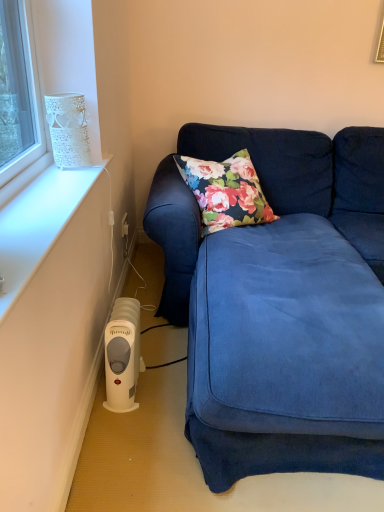
At what (x,y) coordinates should I click in order to perform the action: click on velvet blue couch at lower right. Please return your answer as a coordinate pair (x, y). Image resolution: width=384 pixels, height=512 pixels. Looking at the image, I should click on (263, 284).

In order to face white textured vase at upper left, should I rotate leftwards or rightwards?

To align with it, rotate left about 15.837°.

Image resolution: width=384 pixels, height=512 pixels. I want to click on white plastic heater at lower left, so click(x=122, y=355).

Is white plastic heater at lower left in front of velvet blue couch at lower right?

No, it is not.

In terms of size, does white plastic heater at lower left appear bigger or smaller than velvet blue couch at lower right?

In the image, white plastic heater at lower left appears to be smaller than velvet blue couch at lower right.

How much distance is there between white plastic heater at lower left and velvet blue couch at lower right?

57.08 centimeters.

Could you tell me if white plastic heater at lower left is facing velvet blue couch at lower right?

Yes.

Is white textured vase at upper left outside of velvet blue couch at lower right?

Yes, white textured vase at upper left is outside of velvet blue couch at lower right.

From the image's perspective, is white textured vase at upper left beneath velvet blue couch at lower right?

No, from the image's perspective, white textured vase at upper left is not beneath velvet blue couch at lower right.

Measure the distance between white textured vase at upper left and velvet blue couch at lower right.

white textured vase at upper left and velvet blue couch at lower right are 80.20 centimeters apart from each other.

From a real-world perspective, is white textured vase at upper left located beneath velvet blue couch at lower right?

Incorrect, from a real-world perspective, white textured vase at upper left is higher than velvet blue couch at lower right.

Considering the positions of points (181, 283) and (136, 307), is point (181, 283) farther from camera compared to point (136, 307)?

No.

What's the angular difference between velvet blue couch at lower right and white plastic heater at lower left's facing directions?

There is a 3.24-degree angle between the facing directions of velvet blue couch at lower right and white plastic heater at lower left.

Is velvet blue couch at lower right oriented away from white plastic heater at lower left?

velvet blue couch at lower right does not have its back to white plastic heater at lower left.

Who is smaller, velvet blue couch at lower right or white plastic heater at lower left?

Smaller between the two is white plastic heater at lower left.

Considering the sizes of objects velvet blue couch at lower right and white textured vase at upper left in the image provided, who is smaller, velvet blue couch at lower right or white textured vase at upper left?

Smaller between the two is white textured vase at upper left.

Which object is wider, velvet blue couch at lower right or white textured vase at upper left?

Wider between the two is velvet blue couch at lower right.

What's the angular difference between velvet blue couch at lower right and white textured vase at upper left's facing directions?

The angle between the facing direction of velvet blue couch at lower right and the facing direction of white textured vase at upper left is 94.1 degrees.

Considering the sizes of velvet blue couch at lower right and white textured vase at upper left in the image, is velvet blue couch at lower right taller or shorter than white textured vase at upper left?

velvet blue couch at lower right is taller than white textured vase at upper left.

Is white plastic heater at lower left looking in the opposite direction of white textured vase at upper left?

No, white plastic heater at lower left's orientation is not away from white textured vase at upper left.

Do you think white plastic heater at lower left is within white textured vase at upper left, or outside of it?

white plastic heater at lower left is located beyond the bounds of white textured vase at upper left.

Is white plastic heater at lower left thinner than white textured vase at upper left?

No, white plastic heater at lower left is not thinner than white textured vase at upper left.

Between white plastic heater at lower left and white textured vase at upper left, which one has less height?

With less height is white textured vase at upper left.

From a real-world perspective, is white textured vase at upper left positioned under white plastic heater at lower left based on gravity?

Incorrect, from a real-world perspective, white textured vase at upper left is higher than white plastic heater at lower left.

Is point (53, 99) in front of point (139, 359)?

Yes, it is in front of point (139, 359).

Considering the sizes of objects white textured vase at upper left and white plastic heater at lower left in the image provided, who is thinner, white textured vase at upper left or white plastic heater at lower left?

white textured vase at upper left is thinner.

You are a GUI agent. You are given a task and a screenshot of the screen. Output one action in this format:
    pyautogui.click(x=<x>, y=<y>)
    Task: Click on the studio couch that is above the white plastic heater at lower left (from a real-world perspective)
    
    Given the screenshot: What is the action you would take?
    pyautogui.click(x=263, y=284)

At what (x,y) coordinates should I click in order to perform the action: click on studio couch below the white textured vase at upper left (from the image's perspective). Please return your answer as a coordinate pair (x, y). This screenshot has height=512, width=384. Looking at the image, I should click on (263, 284).

Based on their spatial positions, is velvet blue couch at lower right or white plastic heater at lower left further from white textured vase at upper left?

velvet blue couch at lower right is positioned further to the anchor white textured vase at upper left.

Which object lies nearer to the anchor point white plastic heater at lower left, velvet blue couch at lower right or white textured vase at upper left?

velvet blue couch at lower right is closer to white plastic heater at lower left.

From the image, which object appears to be farther from velvet blue couch at lower right, white plastic heater at lower left or white textured vase at upper left?

Based on the image, white textured vase at upper left appears to be further to velvet blue couch at lower right.

Which object lies nearer to the anchor point white textured vase at upper left, white plastic heater at lower left or velvet blue couch at lower right?

Among the two, white plastic heater at lower left is located nearer to white textured vase at upper left.

Based on their spatial positions, is white textured vase at upper left or velvet blue couch at lower right closer to white plastic heater at lower left?

Based on the image, velvet blue couch at lower right appears to be nearer to white plastic heater at lower left.

Estimate the real-world distances between objects in this image. Which object is closer to velvet blue couch at lower right, white textured vase at upper left or white plastic heater at lower left?

The object closer to velvet blue couch at lower right is white plastic heater at lower left.

Identify the location of appliance between white textured vase at upper left and velvet blue couch at lower right in the horizontal direction. (122, 355).